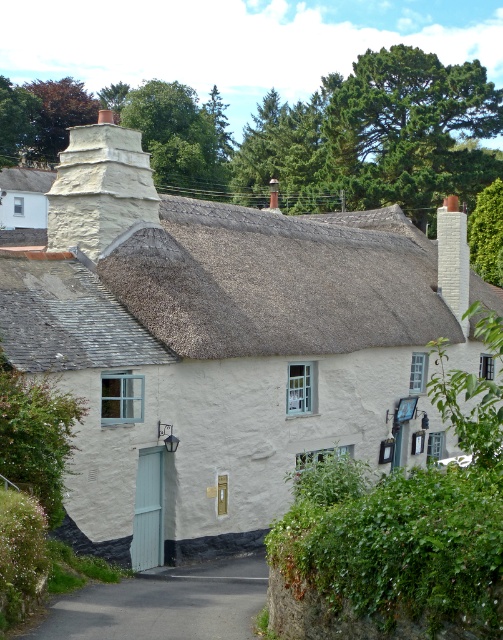
Who is positioned more to the left, white stucco cottage at center or asphalt road at lower center?

white stucco cottage at center is more to the left.

Measure the distance between white stucco cottage at center and asphalt road at lower center.

9.40 meters

This screenshot has height=640, width=503. I want to click on white stucco cottage at center, so click(221, 346).

Does white stucco cottage at center appear over thatched roof at upper center?

Incorrect, white stucco cottage at center is not positioned above thatched roof at upper center.

Which is in front, point (208, 228) or point (79, 317)?

Point (79, 317) is more forward.

Is point (58, 236) positioned behind point (347, 349)?

No, (58, 236) is in front of (347, 349).

Locate an element on the screen. The height and width of the screenshot is (640, 503). white stucco cottage at center is located at coordinates (221, 346).

From the picture: Between asphalt road at lower center and white stone chimney at upper center, which one is positioned higher?

white stone chimney at upper center is above.

Is point (164, 596) more distant than point (91, 173)?

That is False.

Locate an element on the screen. asphalt road at lower center is located at coordinates tap(163, 604).

The image size is (503, 640). Identify the location of asphalt road at lower center. click(163, 604).